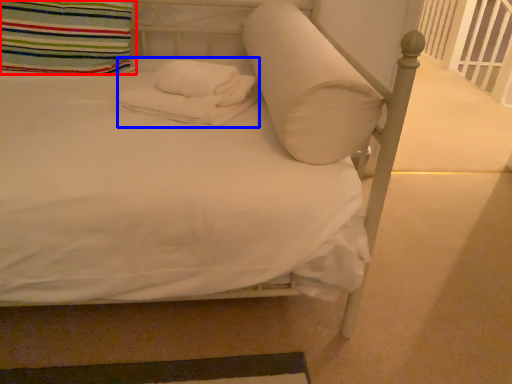
Question: Which point is further to the camera, pillow (highlighted by a red box) or material (highlighted by a blue box)?

Choices:
 (A) pillow
 (B) material

Answer: (A)